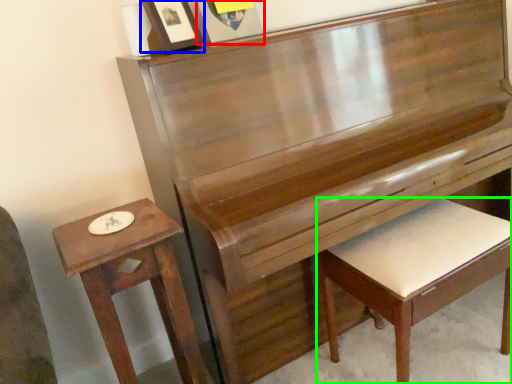
Question: Considering the real-world distances, which object is farthest from picture frame (highlighted by a red box)? picture frame (highlighted by a blue box) or furniture (highlighted by a green box)?

Choices:
 (A) picture frame
 (B) furniture

Answer: (B)